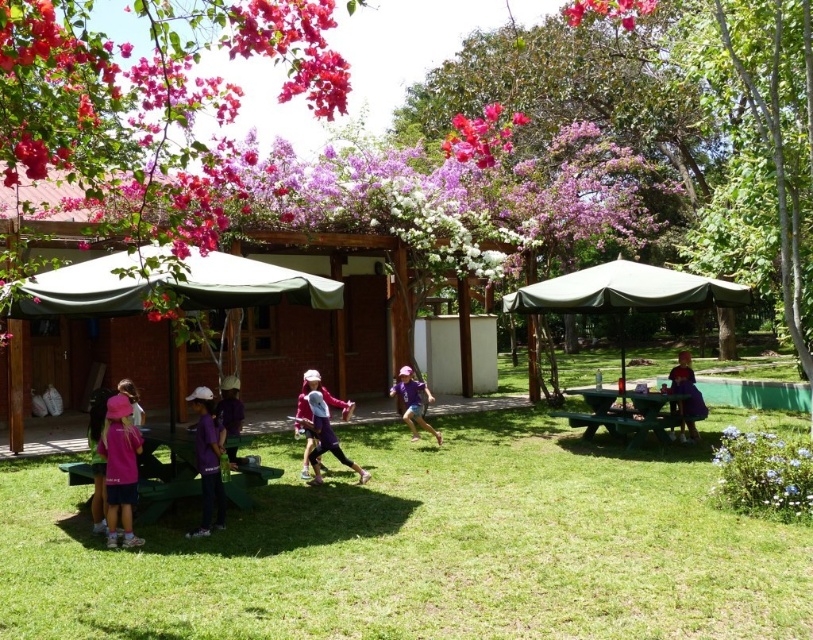
You are standing at the camera position and want to reach the point at coordinates (616, 276). If your walking speed is 1.5 meters per second, how many seconds will it take you to reach that point?

The distance of point (616, 276) from camera is 9.47 meters. At a speed of 1.5 meters per second, it would take approximately 6.31 seconds to reach the point.

You are a photographer standing at the center of the scene wanting to take a photo of the vivid pink petals at upper center without the green wood picnic table at right blocking the view. Is this possible?

The vivid pink petals at upper center is behind the green wood picnic table at right, so the table will block the view of the petals. Move to a position where you can see the petals above or around the table to avoid the obstruction.